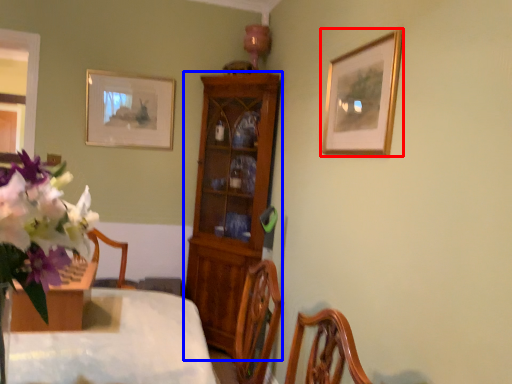
Question: Which object appears farthest to the camera in this image, picture frame (highlighted by a red box) or cabinetry (highlighted by a blue box)?

Choices:
 (A) picture frame
 (B) cabinetry

Answer: (B)